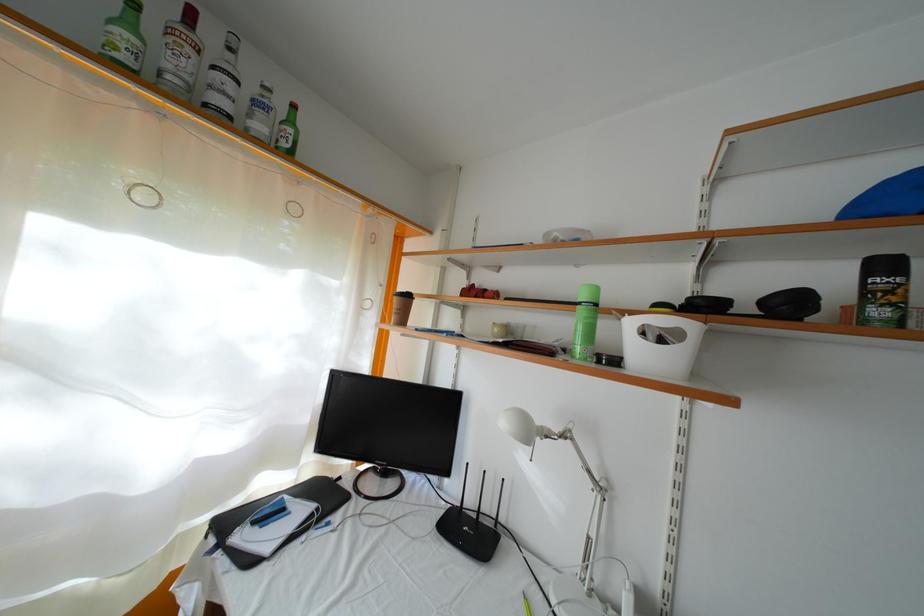
Locate an element on the screen. The width and height of the screenshot is (924, 616). tequila bottle cap is located at coordinates (589, 293).